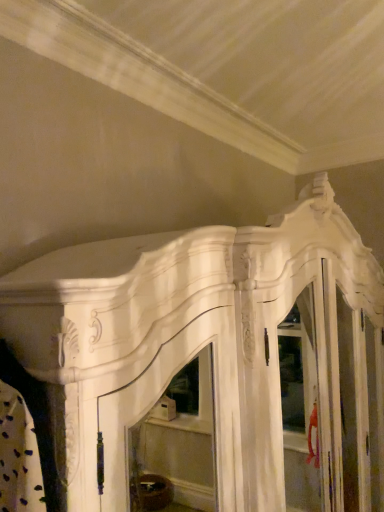
In order to face white glossy dresser at upper center, should I rotate leftwards or rightwards?

Turn right approximately 10.813 degrees to face it.

What do you see at coordinates (193, 358) in the screenshot? This screenshot has height=512, width=384. I see `white glossy dresser at upper center` at bounding box center [193, 358].

Identify the location of white glossy dresser at upper center. The width and height of the screenshot is (384, 512). coord(193,358).

Locate an element on the screen. This screenshot has height=512, width=384. white glossy dresser at upper center is located at coordinates (193, 358).